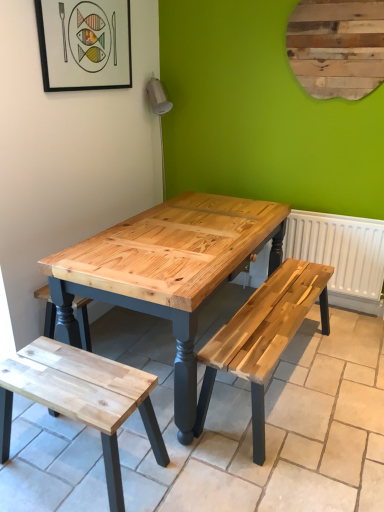
The width and height of the screenshot is (384, 512). What are the coordinates of `wooden plaque at upper right` in the screenshot? It's located at (337, 47).

What do you see at coordinates (340, 249) in the screenshot? This screenshot has width=384, height=512. I see `white matte radiator at right` at bounding box center [340, 249].

Find the location of `wooden plaque at upper right`. wooden plaque at upper right is located at coordinates (337, 47).

Can you confirm if white matte radiator at right is shorter than wooden plaque at upper right?

Incorrect, the height of white matte radiator at right does not fall short of that of wooden plaque at upper right.

Locate an element on the screen. This screenshot has width=384, height=512. radiator that appears behind the wooden plaque at upper right is located at coordinates (340, 249).

From a real-world perspective, is white matte radiator at right located beneath wooden plaque at upper right?

Correct, in the physical world, white matte radiator at right is lower than wooden plaque at upper right.

Which point is more forward, (325, 90) or (304, 257)?

The point (325, 90) is more forward.

From a real-world perspective, which object stands above the other?

wooden plaque at upper right.

From the image's perspective, which one is positioned lower, wooden plaque at upper right or white matte radiator at right?

white matte radiator at right.

The width and height of the screenshot is (384, 512). In order to click on radiator below the wooden plaque at upper right (from a real-world perspective) in this screenshot , I will do `click(340, 249)`.

Is point (366, 243) closer to viewer compared to point (104, 421)?

That is False.

Consider the image. How different are the orientations of white matte radiator at right and natural wood bench at lower left in degrees?

The angular difference between white matte radiator at right and natural wood bench at lower left is 1.26 degrees.

From the image's perspective, who appears lower, white matte radiator at right or natural wood bench at lower left?

From the image's view, natural wood bench at lower left is below.

Could you tell me if white matte radiator at right is turned towards natural wood bench at lower left?

Yes, white matte radiator at right is facing natural wood bench at lower left.

What are the coordinates of `bench below the white matte radiator at right (from the image's perspective)` in the screenshot? It's located at (81, 398).

Can we say natural wood bench at lower left lies outside white matte radiator at right?

Indeed, natural wood bench at lower left is completely outside white matte radiator at right.

Is natural wood bench at lower left beside white matte radiator at right?

natural wood bench at lower left and white matte radiator at right are not in contact.

Which is behind, point (48, 379) or point (335, 276)?

The point (335, 276) is behind.

Is matte black picture frame at upper left turned away from wooden plaque at upper right?

matte black picture frame at upper left does not have its back to wooden plaque at upper right.

Considering the positions of point (40, 32) and point (342, 34), is point (40, 32) closer or farther from the camera than point (342, 34)?

Point (40, 32) is closer to the camera than point (342, 34).

Considering the sizes of objects matte black picture frame at upper left and wooden plaque at upper right in the image provided, who is wider, matte black picture frame at upper left or wooden plaque at upper right?

matte black picture frame at upper left.

Based on their positions, is matte black picture frame at upper left located to the left or right of wooden plaque at upper right?

matte black picture frame at upper left is positioned on wooden plaque at upper right's left side.

Is matte black picture frame at upper left positioned far away from natural wood bench at lower left?

Yes, matte black picture frame at upper left and natural wood bench at lower left are located far from each other.

Which object is wider, matte black picture frame at upper left or natural wood bench at lower left?

natural wood bench at lower left.

Is matte black picture frame at upper left further to the viewer compared to natural wood bench at lower left?

That is True.

Can you confirm if matte black picture frame at upper left is positioned to the left of natural wood bench at lower left?

Yes.

Where is `radiator that is on the right side of matte black picture frame at upper left`? This screenshot has width=384, height=512. radiator that is on the right side of matte black picture frame at upper left is located at coordinates (x=340, y=249).

From a real-world perspective, who is located lower, white matte radiator at right or matte black picture frame at upper left?

In real-world perspective, white matte radiator at right is lower.

Is white matte radiator at right in front of matte black picture frame at upper left?

No, white matte radiator at right is further to the viewer.

Which object is positioned more to the right, white matte radiator at right or matte black picture frame at upper left?

From the viewer's perspective, white matte radiator at right appears more on the right side.

The image size is (384, 512). What are the coordinates of `radiator directly beneath the wooden plaque at upper right (from a real-world perspective)` in the screenshot? It's located at pyautogui.click(x=340, y=249).

This screenshot has width=384, height=512. I want to click on bulletin board above the white matte radiator at right (from a real-world perspective), so click(x=337, y=47).

Which object lies nearer to the anchor point white matte radiator at right, natural wood bench at lower left or wooden plaque at upper right?

Among the two, wooden plaque at upper right is located nearer to white matte radiator at right.

From the image, which object appears to be nearer to white matte radiator at right, wooden plaque at upper right or matte black picture frame at upper left?

wooden plaque at upper right.

Which object lies nearer to the anchor point white matte radiator at right, natural wood bench at lower left or matte black picture frame at upper left?

Among the two, natural wood bench at lower left is located nearer to white matte radiator at right.

Which object lies further to the anchor point natural wood bench at lower left, matte black picture frame at upper left or wooden plaque at upper right?

Based on the image, wooden plaque at upper right appears to be further to natural wood bench at lower left.

Which object lies nearer to the anchor point natural wood bench at lower left, matte black picture frame at upper left or white matte radiator at right?

matte black picture frame at upper left lies closer to natural wood bench at lower left than the other object.

Looking at the image, which one is located further to natural wood bench at lower left, white matte radiator at right or wooden plaque at upper right?

The object further to natural wood bench at lower left is wooden plaque at upper right.

Based on their spatial positions, is matte black picture frame at upper left or wooden plaque at upper right further from white matte radiator at right?

matte black picture frame at upper left is positioned further to the anchor white matte radiator at right.

Looking at the image, which one is located further to wooden plaque at upper right, white matte radiator at right or natural wood bench at lower left?

natural wood bench at lower left is further to wooden plaque at upper right.

Locate an element on the screen. radiator between matte black picture frame at upper left and natural wood bench at lower left in the up-down direction is located at coordinates [340, 249].

Locate an element on the screen. radiator that lies between wooden plaque at upper right and natural wood bench at lower left from top to bottom is located at coordinates (340, 249).

This screenshot has height=512, width=384. What are the coordinates of `picture frame between wooden plaque at upper right and natural wood bench at lower left from top to bottom` in the screenshot? It's located at (84, 44).

Identify the location of bulletin board between matte black picture frame at upper left and white matte radiator at right in the horizontal direction. Image resolution: width=384 pixels, height=512 pixels. (337, 47).